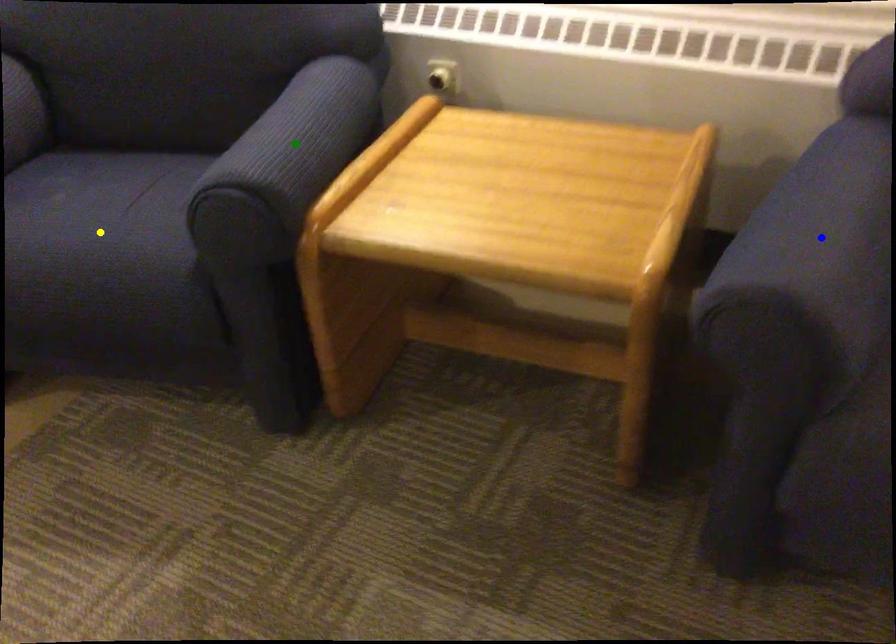
Order these from nearest to farthest:
A) yellow point
B) green point
C) blue point

1. blue point
2. green point
3. yellow point